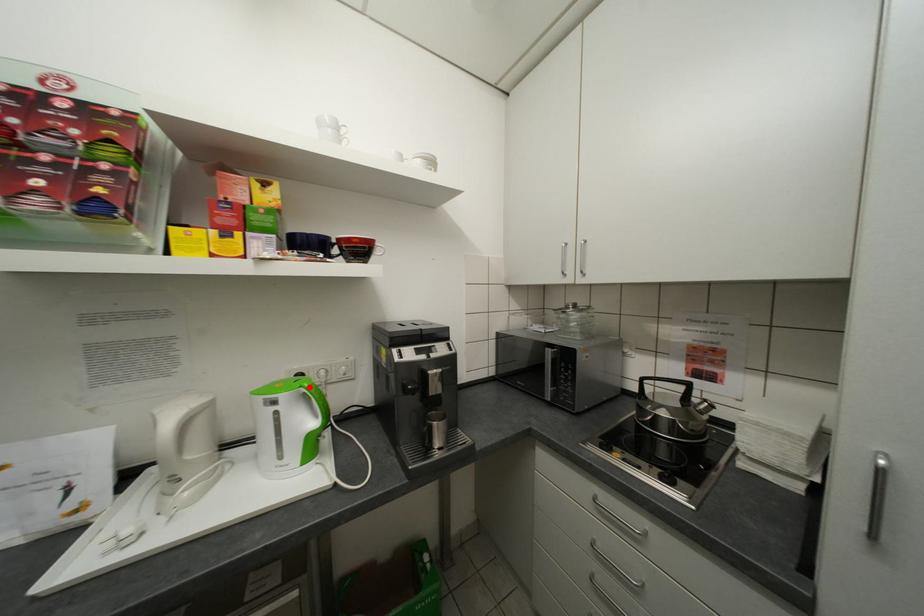
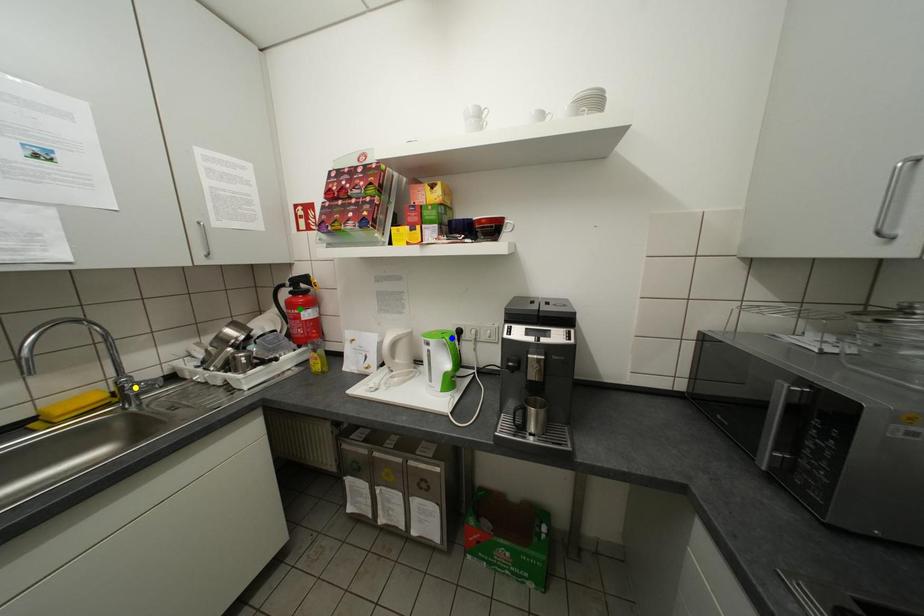
Question: I am providing you with two images of the same scene from different viewpoints. A red point is marked on the first image. You are given multiple points on the second image. Which mark in image 2 goes with the point in image 1?

Choices:
 (A) green point
 (B) yellow point
 (C) blue point

Answer: (C)